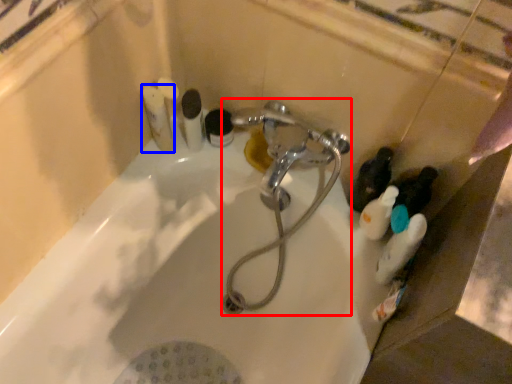
Question: Which object is closer to the camera taking this photo, plumbing fixture (highlighted by a red box) or toiletry (highlighted by a blue box)?

Choices:
 (A) plumbing fixture
 (B) toiletry

Answer: (A)